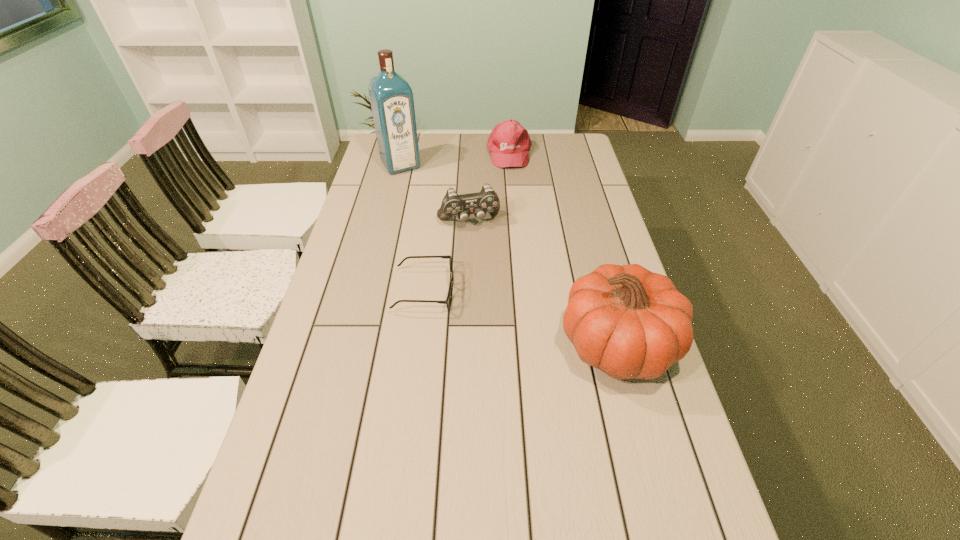
The width and height of the screenshot is (960, 540). Identify the location of spectacles. (448, 301).

This screenshot has height=540, width=960. I want to click on the second tallest object, so click(x=628, y=322).

This screenshot has width=960, height=540. Find the location of `liquor`. liquor is located at coordinates (391, 97).

At what (x,y) coordinates should I click in order to perform the action: click on baseball cap. Please return your answer as a coordinate pair (x, y). The width and height of the screenshot is (960, 540). Looking at the image, I should click on (509, 143).

The width and height of the screenshot is (960, 540). Find the location of `the third nearest object`. the third nearest object is located at coordinates (487, 200).

Identify the location of free point located on the front-facing side of the shortest object. The width and height of the screenshot is (960, 540). (531, 291).

The width and height of the screenshot is (960, 540). In order to click on vacant space situated 0.220m on the flat label side of the tallest object in this screenshot , I will do `click(427, 205)`.

Where is `vacant space situated 0.360m on the flat label side of the tallest object`? Image resolution: width=960 pixels, height=540 pixels. vacant space situated 0.360m on the flat label side of the tallest object is located at coordinates (442, 227).

The width and height of the screenshot is (960, 540). I want to click on vacant space situated 0.260m on the flat label side of the tallest object, so (x=431, y=211).

Where is `blank space located 0.350m at the front of the baseball cap with the brim`? blank space located 0.350m at the front of the baseball cap with the brim is located at coordinates (521, 226).